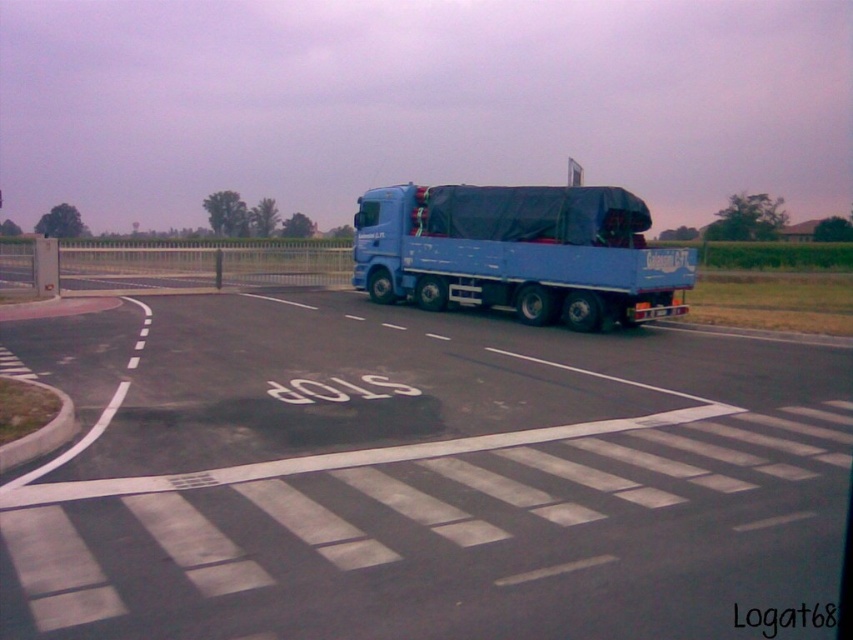
Question: Is blue rubber truck at center below blue matte trailer truck at center?

Choices:
 (A) yes
 (B) no

Answer: (A)

Question: Is blue rubber truck at center positioned at the back of blue matte trailer truck at center?

Choices:
 (A) yes
 (B) no

Answer: (B)

Question: Is blue rubber truck at center above blue matte trailer truck at center?

Choices:
 (A) yes
 (B) no

Answer: (B)

Question: Among these points, which one is nearest to the camera?

Choices:
 (A) (370, 225)
 (B) (399, 632)

Answer: (B)

Question: Which of the following is the closest to the observer?

Choices:
 (A) blue matte trailer truck at center
 (B) blue rubber truck at center

Answer: (B)